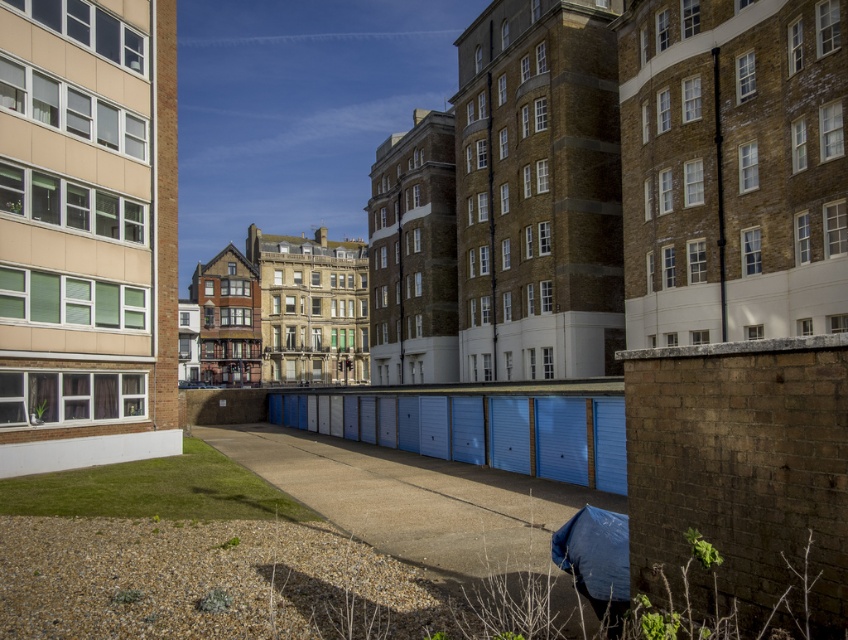
You are standing at the entrance of the left building and want to reach the smooth concrete pavement at center. Which direction should you walk to get there?

The smooth concrete pavement at center is located at point coordinates, so you should walk towards the center of the image to reach it.

You are standing at the entrance of the left building and want to walk to the point at coordinates point [452,474] and point [600,580]. Which point will you reach first?

You will reach point [452,474] first because it is closer to you than point [600,580], which is further away.

Looking at this image, you are a delivery person trying to park your bike. You see the smooth concrete pavement at center and the blue fabric umbrella at lower right. Which area has enough space to park your bike without overlapping any objects?

The smooth concrete pavement at center has a larger width than the blue fabric umbrella at lower right, so it can accommodate the bike without overlapping any objects.